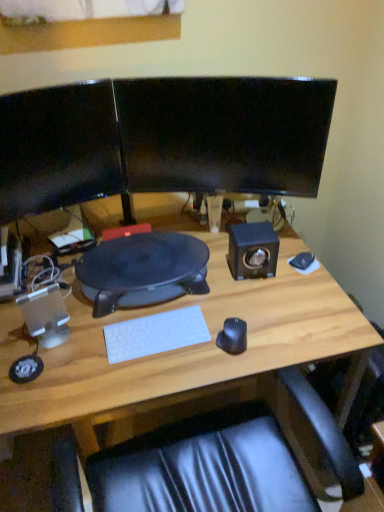
Identify the location of free space between white matte keyboard at center and black rubberized desk at center. (145, 316).